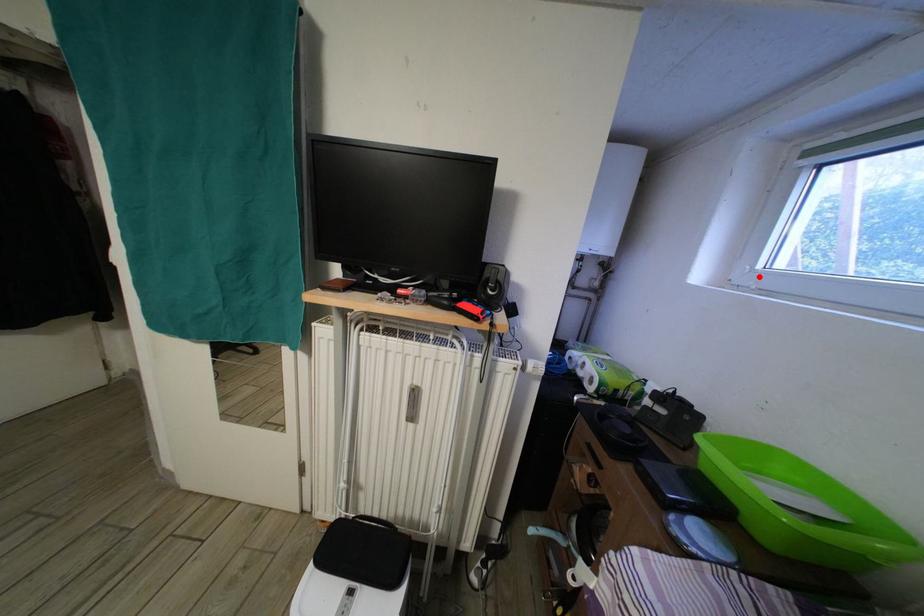
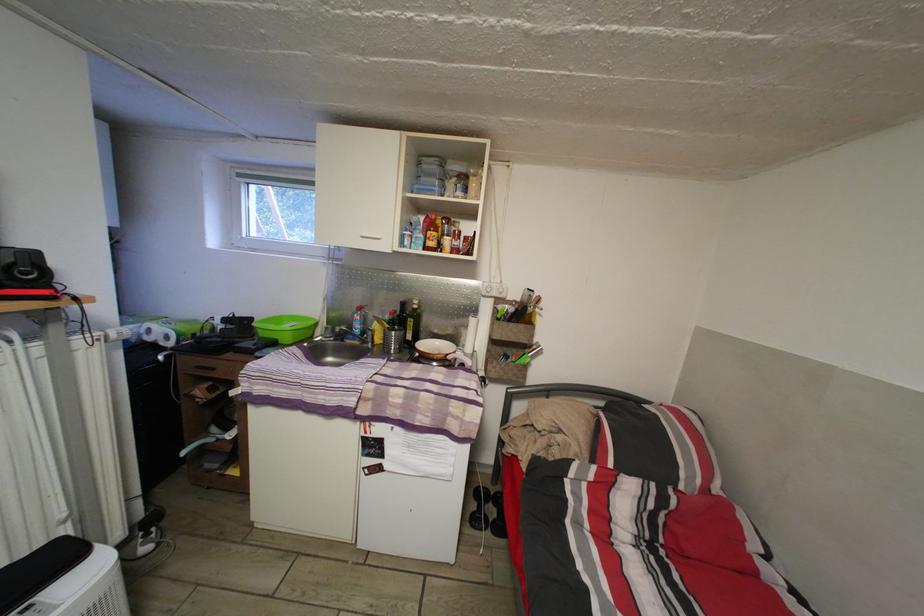
Locate, in the second image, the point that corresponds to the highlighted location in the first image.

(249, 244)